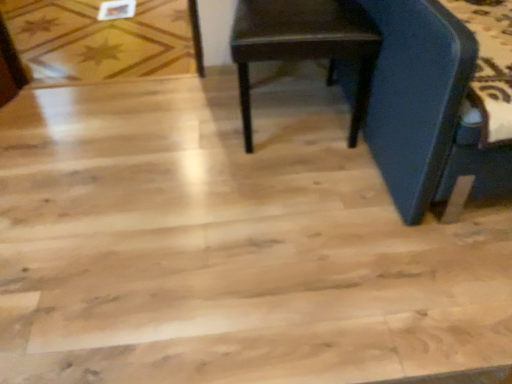
What are the coordinates of `dark brown wood chair at center` in the screenshot? It's located at (304, 44).

The image size is (512, 384). What do you see at coordinates (304, 44) in the screenshot?
I see `dark brown wood chair at center` at bounding box center [304, 44].

In order to face dark brown wood chair at center, should I rotate leftwards or rightwards?

Turn right by 4.674 degrees to look at dark brown wood chair at center.

Describe the element at coordinates (103, 40) in the screenshot. I see `wooden star-patterned floor at upper left` at that location.

Find the location of a particular element. wooden star-patterned floor at upper left is located at coordinates (103, 40).

Identify the location of dark brown wood chair at center. Image resolution: width=512 pixels, height=384 pixels. (304, 44).

Which object is positioned more to the right, wooden star-patterned floor at upper left or dark brown wood chair at center?

dark brown wood chair at center is more to the right.

Who is more distant, wooden star-patterned floor at upper left or dark brown wood chair at center?

wooden star-patterned floor at upper left is further from the camera.

Does point (52, 49) come behind point (250, 34)?

Yes, it is.

From the image's perspective, is wooden star-patterned floor at upper left above dark brown wood chair at center?

Yes, from the image's perspective, wooden star-patterned floor at upper left is over dark brown wood chair at center.

From a real-world perspective, is wooden star-patterned floor at upper left above or below dark brown wood chair at center?

In terms of real-world spatial position, wooden star-patterned floor at upper left is below dark brown wood chair at center.

Considering the relative sizes of wooden star-patterned floor at upper left and dark brown wood chair at center in the image provided, is wooden star-patterned floor at upper left wider than dark brown wood chair at center?

Correct, the width of wooden star-patterned floor at upper left exceeds that of dark brown wood chair at center.

Is wooden star-patterned floor at upper left taller or shorter than dark brown wood chair at center?

Clearly, wooden star-patterned floor at upper left is shorter compared to dark brown wood chair at center.

Who is bigger, wooden star-patterned floor at upper left or dark brown wood chair at center?

dark brown wood chair at center is bigger.

Is wooden star-patterned floor at upper left surrounding dark brown wood chair at center?

No, dark brown wood chair at center is located outside of wooden star-patterned floor at upper left.

Is wooden star-patterned floor at upper left next to dark brown wood chair at center?

No, wooden star-patterned floor at upper left is not in contact with dark brown wood chair at center.

Is wooden star-patterned floor at upper left facing towards dark brown wood chair at center?

No, wooden star-patterned floor at upper left is not facing towards dark brown wood chair at center.

How many degrees apart are the facing directions of wooden star-patterned floor at upper left and dark brown wood chair at center?

3.34 degrees.

Identify the location of chair that appears on the right of wooden star-patterned floor at upper left. This screenshot has height=384, width=512. (304, 44).

In the image, is dark brown wood chair at center on the left side or the right side of wooden star-patterned floor at upper left?

dark brown wood chair at center is positioned on wooden star-patterned floor at upper left's right side.

Does dark brown wood chair at center come in front of wooden star-patterned floor at upper left?

Yes, the depth of dark brown wood chair at center is less than that of wooden star-patterned floor at upper left.

Which is nearer, (x=364, y=12) or (x=8, y=18)?

Point (x=364, y=12) appears to be closer to the viewer than point (x=8, y=18).

In the scene shown: From the image's perspective, which one is positioned higher, dark brown wood chair at center or wooden star-patterned floor at upper left?

wooden star-patterned floor at upper left, from the image's perspective.

From a real-world perspective, is dark brown wood chair at center below wooden star-patterned floor at upper left?

No, from a real-world perspective, dark brown wood chair at center is not below wooden star-patterned floor at upper left.

Considering the sizes of dark brown wood chair at center and wooden star-patterned floor at upper left in the image, is dark brown wood chair at center wider or thinner than wooden star-patterned floor at upper left?

In the image, dark brown wood chair at center appears to be more narrow than wooden star-patterned floor at upper left.

Is dark brown wood chair at center taller than wooden star-patterned floor at upper left?

Yes, dark brown wood chair at center is taller than wooden star-patterned floor at upper left.

Is dark brown wood chair at center bigger or smaller than wooden star-patterned floor at upper left?

dark brown wood chair at center is bigger than wooden star-patterned floor at upper left.

Is wooden star-patterned floor at upper left surrounded by dark brown wood chair at center?

Actually, wooden star-patterned floor at upper left is outside dark brown wood chair at center.

Is the surface of dark brown wood chair at center in direct contact with wooden star-patterned floor at upper left?

dark brown wood chair at center and wooden star-patterned floor at upper left are not in contact.

Is dark brown wood chair at center facing away from wooden star-patterned floor at upper left?

No, dark brown wood chair at center is not facing away from wooden star-patterned floor at upper left.

How many degrees apart are the facing directions of dark brown wood chair at center and wooden star-patterned floor at upper left?

The facing directions of dark brown wood chair at center and wooden star-patterned floor at upper left are 3.34 degrees apart.

Measure the distance between dark brown wood chair at center and wooden star-patterned floor at upper left.

The distance of dark brown wood chair at center from wooden star-patterned floor at upper left is 3.33 feet.

Find the location of a particular element. The height and width of the screenshot is (384, 512). chair below the wooden star-patterned floor at upper left (from the image's perspective) is located at coordinates (304, 44).

This screenshot has height=384, width=512. What are the coordinates of `plywood behind the dark brown wood chair at center` in the screenshot? It's located at (103, 40).

Locate an element on the screen. The width and height of the screenshot is (512, 384). chair that appears in front of the wooden star-patterned floor at upper left is located at coordinates (304, 44).